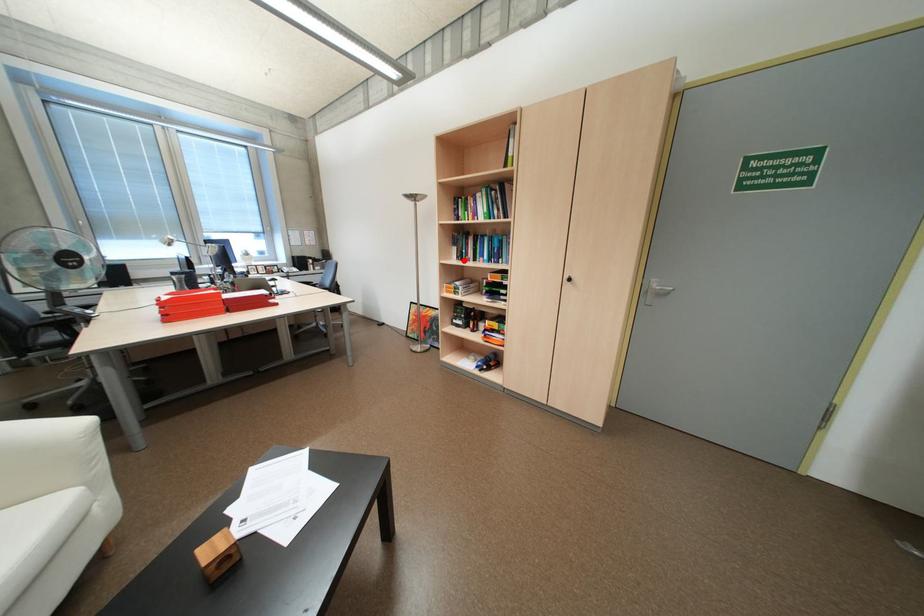
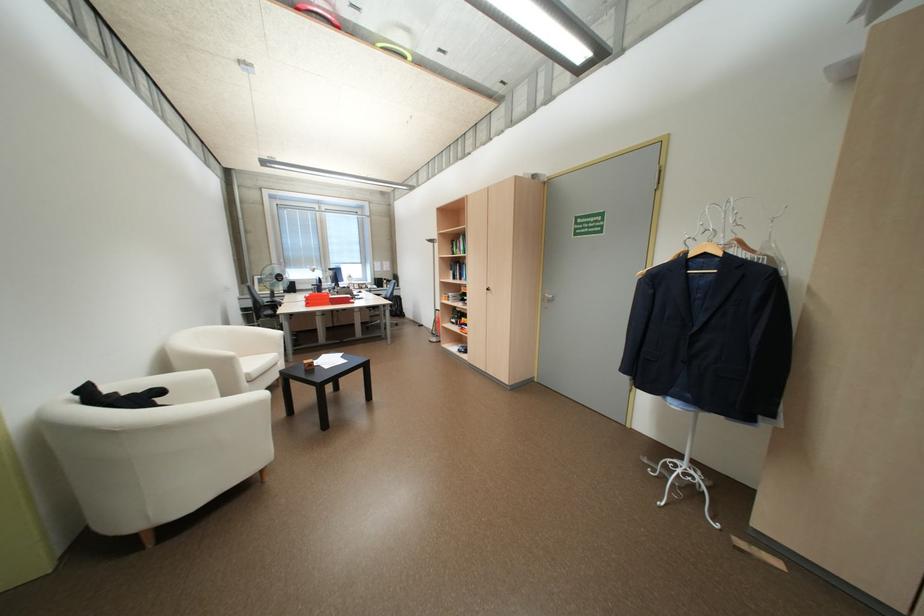
The point at the highlighted location is marked in the first image. Where is the corresponding point in the second image?

(460, 280)